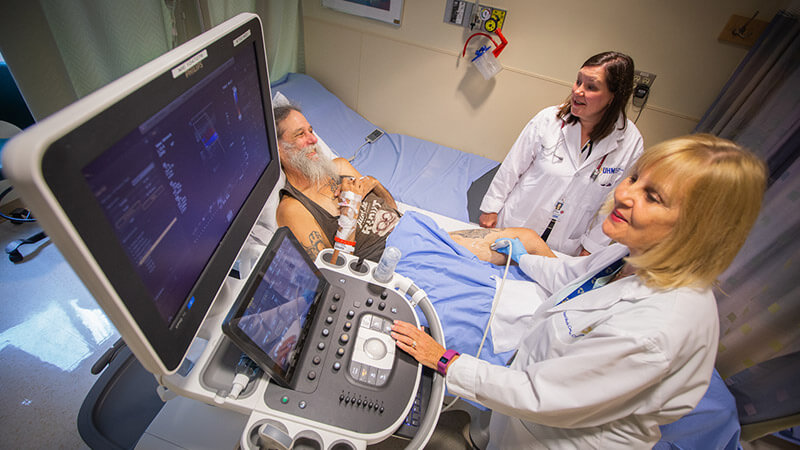
Locate an element on the screen. This screenshot has width=800, height=450. floor is located at coordinates (36, 329).